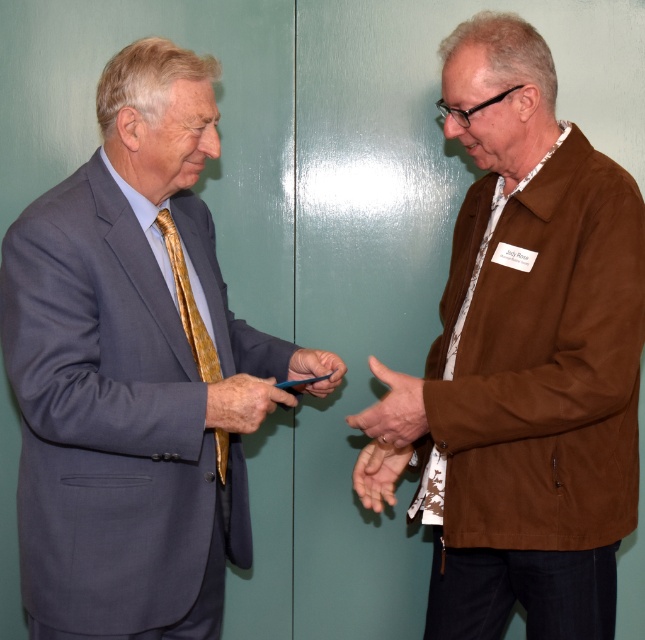
Looking at this image, you are a photographer taking a portrait of the two people in the scene. You want to ensure that the brown textured tie at right is centered in the frame. What adjustment should you make to the camera position?

To center the brown textured tie at right, move the camera to the left since the tie is positioned at point 0.430 on the horizontal axis, which is to the left of the center point 0.5. This adjustment will bring the tie closer to the center of the frame.

You are standing in front of the two individuals in the scene. The person on the right is wearing a brown suede jacket. If you want to hand a document to the person on the left, who is not wearing the jacket, which direction should you approach from relative to the brown suede jacket at right?

To hand the document to the person on the left, you should approach from the left side of the brown suede jacket at right since the person on the left is positioned to the left of the jacket.